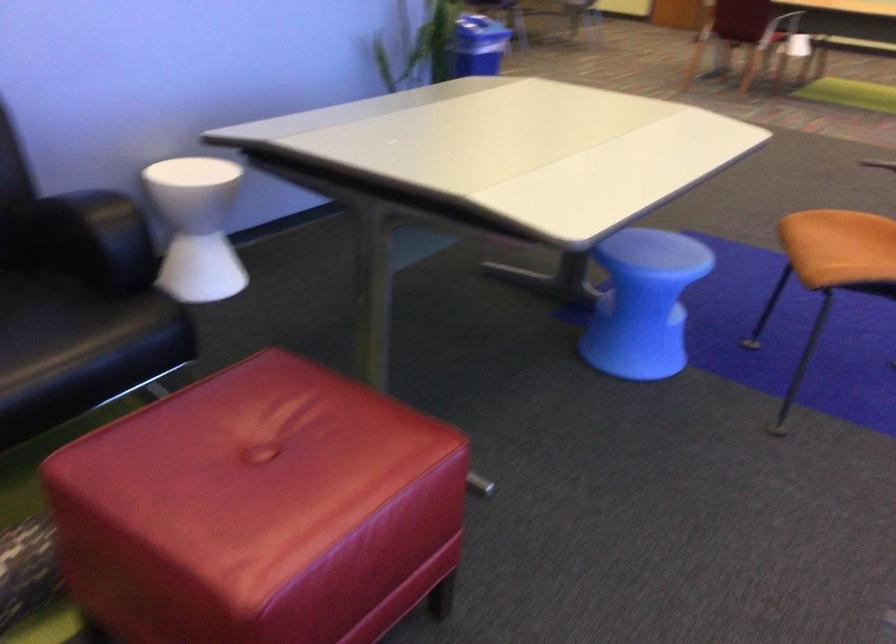
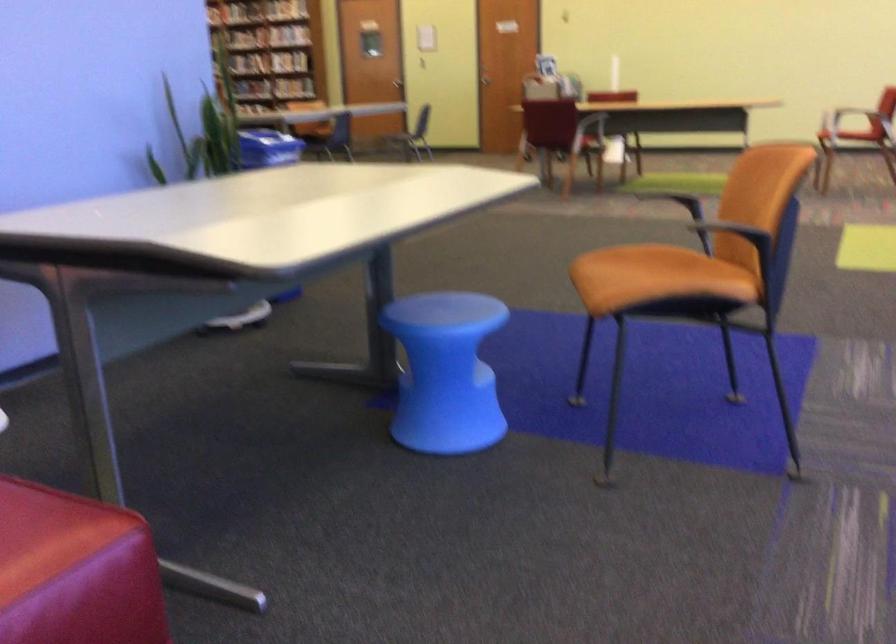
Find the pixel in the second image that matches pixel 398 447 in the first image.

(47, 534)